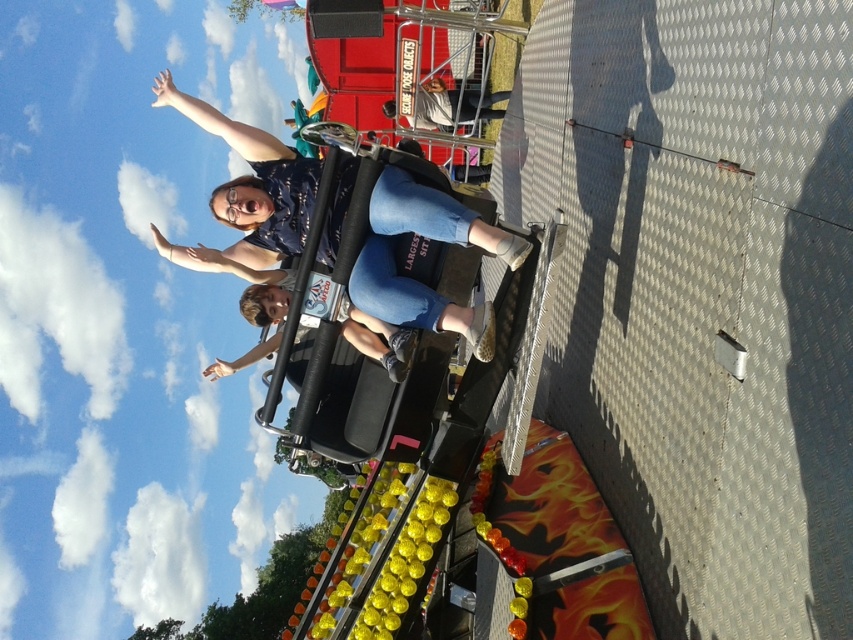
Question: Which of these objects is positioned farthest from the light brown leather jacket at center?

Choices:
 (A) denim jeans at center
 (B) matte black helmet at upper center

Answer: (B)

Question: Is denim jeans at center smaller than matte black helmet at upper center?

Choices:
 (A) yes
 (B) no

Answer: (A)

Question: Which of the following is the farthest from the observer?

Choices:
 (A) denim jeans at center
 (B) matte black helmet at upper center
 (C) light brown leather jacket at center

Answer: (B)

Question: Can you confirm if denim jeans at center is positioned to the right of matte black helmet at upper center?

Choices:
 (A) yes
 (B) no

Answer: (B)

Question: Which object appears farthest from the camera in this image?

Choices:
 (A) matte black helmet at upper center
 (B) light brown leather jacket at center
 (C) denim jeans at center

Answer: (A)

Question: Is denim jeans at center to the right of light brown leather jacket at center from the viewer's perspective?

Choices:
 (A) yes
 (B) no

Answer: (B)